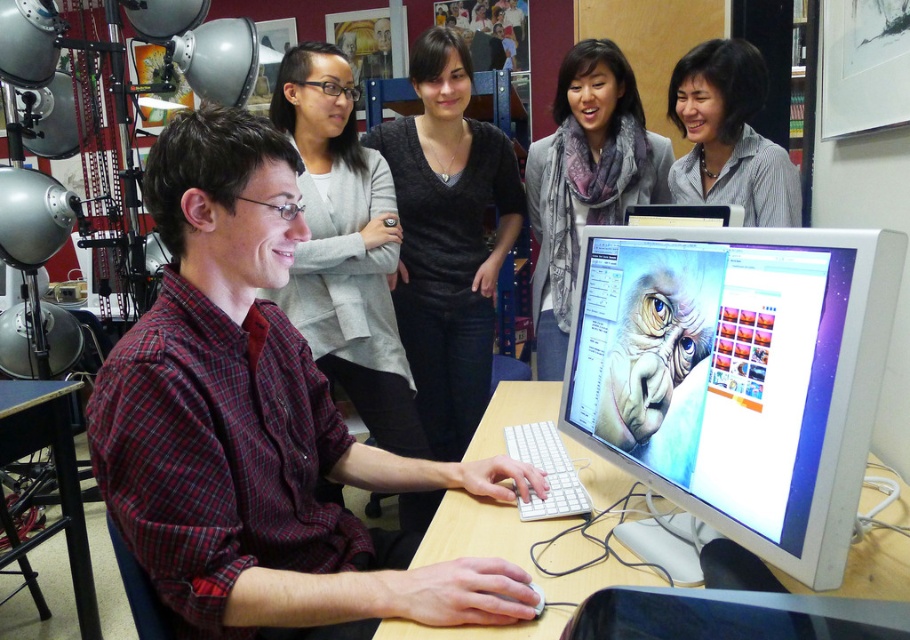
Question: Considering the relative positions of plaid shirt at center and gray scarf at upper center in the image provided, where is plaid shirt at center located with respect to gray scarf at upper center?

Choices:
 (A) above
 (B) below

Answer: (B)

Question: Which point is closer to the camera?

Choices:
 (A) (718, 278)
 (B) (703, 134)
 (C) (350, 326)
 (D) (693, 632)

Answer: (D)

Question: Among these objects, which one is nearest to the camera?

Choices:
 (A) gray striped shirt at upper right
 (B) plaid shirt at center
 (C) black wood table at lower left
 (D) plaid flannel shirt at left

Answer: (B)

Question: Which point is farther to the camera?

Choices:
 (A) (637, 131)
 (B) (139, 518)

Answer: (A)

Question: Observing the image, what is the correct spatial positioning of gray scarf at upper center in reference to gray striped shirt at upper right?

Choices:
 (A) below
 (B) above

Answer: (A)

Question: Does gray striped shirt at upper right lie behind black glossy monitor at center?

Choices:
 (A) yes
 (B) no

Answer: (A)